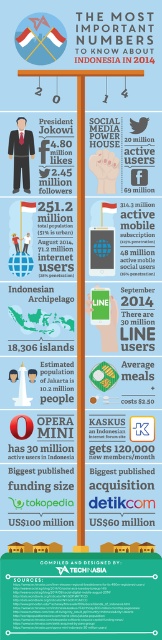
In the scene shown: Does white paper text at upper center have a larger size compared to white glossy flag at center?

Indeed, white paper text at upper center has a larger size compared to white glossy flag at center.

Is white paper text at upper center positioned before white glossy flag at center?

Yes.

Who is more distant from viewer, (99, 32) or (40, 26)?

Positioned behind is point (99, 32).

In order to click on white paper text at upper center in this screenshot , I will do `click(114, 36)`.

Is white paper text at upper center wider than matte black mobile phone at center?

Indeed, white paper text at upper center has a greater width compared to matte black mobile phone at center.

Image resolution: width=162 pixels, height=640 pixels. Describe the element at coordinates (114, 36) in the screenshot. I see `white paper text at upper center` at that location.

This screenshot has height=640, width=162. What are the coordinates of `white paper text at upper center` in the screenshot? It's located at pos(114,36).

Is matte black mobile phone at center to the left of white glossy flag at center from the viewer's perspective?

No, matte black mobile phone at center is not to the left of white glossy flag at center.

Describe the element at coordinates (137, 237) in the screenshot. I see `matte black mobile phone at center` at that location.

At what (x,y) coordinates should I click in order to perform the action: click on matte black mobile phone at center. Please return your answer as a coordinate pair (x, y). Image resolution: width=162 pixels, height=640 pixels. Looking at the image, I should click on (137, 237).

This screenshot has height=640, width=162. In order to click on matte black mobile phone at center in this screenshot , I will do `click(137, 237)`.